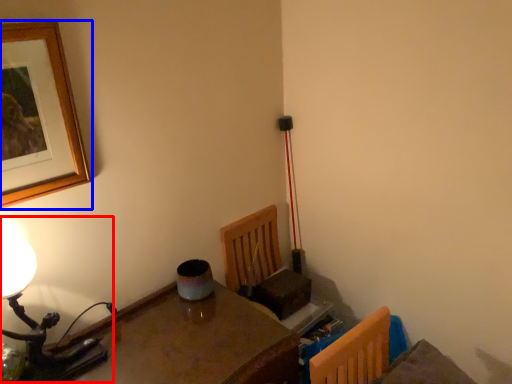
Question: Which object is further to the camera taking this photo, table lamp (highlighted by a red box) or picture frame (highlighted by a blue box)?

Choices:
 (A) table lamp
 (B) picture frame

Answer: (A)